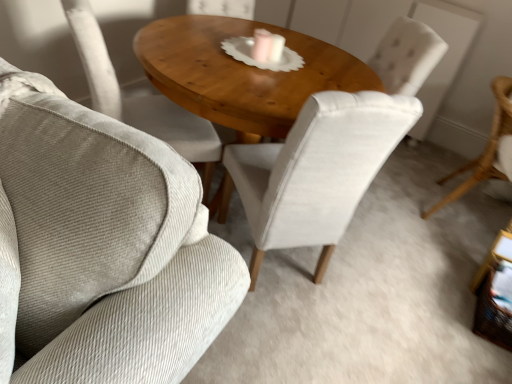
This screenshot has height=384, width=512. I want to click on light brown wicker chair at right, positioned as the 3th chair in left-to-right order, so click(x=486, y=148).

Locate an element on the screen. light beige fabric chair at center, which ranks as the third chair in right-to-left order is located at coordinates (140, 98).

What is the approximate width of light beige fabric chair at center, which ranks as the third chair in right-to-left order?

light beige fabric chair at center, which ranks as the third chair in right-to-left order, is 24.38 inches in width.

The image size is (512, 384). Find the location of `woven wicker side table at lower right`. woven wicker side table at lower right is located at coordinates (495, 293).

Locate an element on the screen. The height and width of the screenshot is (384, 512). wooden polished table at center is located at coordinates (242, 73).

Is velvet white chair at center, which ranks as the 2th chair in right-to-left order, positioned with its back to light brown wicker chair at right, acting as the 1th chair starting from the right?

No, velvet white chair at center, which ranks as the 2th chair in right-to-left order,'s orientation is not away from light brown wicker chair at right, acting as the 1th chair starting from the right.

In the image, is velvet white chair at center, placed as the 2th chair when sorted from left to right, on the left side or the right side of light brown wicker chair at right, acting as the 1th chair starting from the right?

In the image, velvet white chair at center, placed as the 2th chair when sorted from left to right, appears on the left side of light brown wicker chair at right, acting as the 1th chair starting from the right.

Is point (258, 178) closer to viewer compared to point (507, 81)?

That is True.

From the picture: How much distance is there between light beige fabric chair at center, which ranks as the third chair in right-to-left order, and velvet white chair at center, which ranks as the 2th chair in right-to-left order?

The distance of light beige fabric chair at center, which ranks as the third chair in right-to-left order, from velvet white chair at center, which ranks as the 2th chair in right-to-left order, is 21.51 inches.

This screenshot has width=512, height=384. In order to click on chair in front of the light beige fabric chair at center, which ranks as the third chair in right-to-left order in this screenshot , I will do `click(317, 170)`.

Does light beige fabric chair at center, which is counted as the first chair, starting from the left, have a lesser height compared to velvet white chair at center, placed as the 2th chair when sorted from left to right?

Indeed, light beige fabric chair at center, which is counted as the first chair, starting from the left, has a lesser height compared to velvet white chair at center, placed as the 2th chair when sorted from left to right.

Is velvet white chair at center, placed as the 2th chair when sorted from left to right, inside light beige fabric chair at center, which is counted as the first chair, starting from the left?

No.

Which of these two, light beige fabric chair at center, which is counted as the first chair, starting from the left, or woven wicker side table at lower right, is thinner?

Thinner between the two is woven wicker side table at lower right.

Is light beige fabric chair at center, which is counted as the first chair, starting from the left, positioned with its back to woven wicker side table at lower right?

No, light beige fabric chair at center, which is counted as the first chair, starting from the left, is not facing away from woven wicker side table at lower right.

Is light beige fabric chair at center, which is counted as the first chair, starting from the left, at the right side of woven wicker side table at lower right?

No, light beige fabric chair at center, which is counted as the first chair, starting from the left, is not to the right of woven wicker side table at lower right.

This screenshot has width=512, height=384. I want to click on side table below the light beige fabric chair at center, which is counted as the first chair, starting from the left (from the image's perspective), so click(x=495, y=293).

Choose the correct answer: Is light brown wicker chair at right, positioned as the 3th chair in left-to-right order, inside woven wicker side table at lower right or outside it?

light brown wicker chair at right, positioned as the 3th chair in left-to-right order, is spatially situated outside woven wicker side table at lower right.

Who is shorter, light brown wicker chair at right, acting as the 1th chair starting from the right, or woven wicker side table at lower right?

With less height is woven wicker side table at lower right.

Does velvet white chair at center, placed as the 2th chair when sorted from left to right, have a greater height compared to light beige fabric chair at center, which is counted as the first chair, starting from the left?

Correct, velvet white chair at center, placed as the 2th chair when sorted from left to right, is much taller as light beige fabric chair at center, which is counted as the first chair, starting from the left.

Considering the relative sizes of velvet white chair at center, which ranks as the 2th chair in right-to-left order, and light beige fabric chair at center, which is counted as the first chair, starting from the left, in the image provided, is velvet white chair at center, which ranks as the 2th chair in right-to-left order, smaller than light beige fabric chair at center, which is counted as the first chair, starting from the left,?

Incorrect, velvet white chair at center, which ranks as the 2th chair in right-to-left order, is not smaller in size than light beige fabric chair at center, which is counted as the first chair, starting from the left.

Looking at this image, are velvet white chair at center, which ranks as the 2th chair in right-to-left order, and light beige fabric chair at center, which is counted as the first chair, starting from the left, making contact?

They are not placed beside each other.

Considering the points (318, 273) and (194, 149), which point is in front, point (318, 273) or point (194, 149)?

The point (194, 149) is closer to the camera.

From a real-world perspective, is woven wicker side table at lower right above or below light brown wicker chair at right, positioned as the 3th chair in left-to-right order?

In terms of real-world spatial position, woven wicker side table at lower right is below light brown wicker chair at right, positioned as the 3th chair in left-to-right order.

In the scene shown: Is woven wicker side table at lower right at the right side of light brown wicker chair at right, acting as the 1th chair starting from the right?

No.

Looking at this image, is there a large distance between woven wicker side table at lower right and light brown wicker chair at right, positioned as the 3th chair in left-to-right order?

No, woven wicker side table at lower right is in close proximity to light brown wicker chair at right, positioned as the 3th chair in left-to-right order.

From a real-world perspective, between wooden polished table at center and light beige fabric chair at center, which ranks as the third chair in right-to-left order, who is vertically higher?

light beige fabric chair at center, which ranks as the third chair in right-to-left order, from a real-world perspective.

Which of these two, wooden polished table at center or light beige fabric chair at center, which is counted as the first chair, starting from the left, stands taller?

wooden polished table at center.

In the image, is wooden polished table at center positioned in front of or behind light beige fabric chair at center, which is counted as the first chair, starting from the left?

In the image, wooden polished table at center appears in front of light beige fabric chair at center, which is counted as the first chair, starting from the left.

Does wooden polished table at center have a lesser width compared to light beige fabric chair at center, which ranks as the third chair in right-to-left order?

Incorrect, the width of wooden polished table at center is not less than that of light beige fabric chair at center, which ranks as the third chair in right-to-left order.

From the image's perspective, which chair is the 1st one above the velvet white chair at center, placed as the 2th chair when sorted from left to right? Please provide its 2D coordinates.

[(486, 148)]

From a real-world perspective, starting from the light beige fabric chair at center, which is counted as the first chair, starting from the left, which chair is the 1st one below it? Please provide its 2D coordinates.

[(317, 170)]

Estimate the real-world distances between objects in this image. Which object is closer to woven wicker side table at lower right, light brown wicker chair at right, positioned as the 3th chair in left-to-right order, or light beige fabric chair at center, which is counted as the first chair, starting from the left?

Based on the image, light brown wicker chair at right, positioned as the 3th chair in left-to-right order, appears to be nearer to woven wicker side table at lower right.

In the scene shown: When comparing their distances from woven wicker side table at lower right, does wooden polished table at center or velvet white chair at center, which ranks as the 2th chair in right-to-left order, seem closer?

velvet white chair at center, which ranks as the 2th chair in right-to-left order, is positioned closer to the anchor woven wicker side table at lower right.

Based on their spatial positions, is light beige fabric chair at center, which ranks as the third chair in right-to-left order, or wooden polished table at center further from velvet white chair at center, which ranks as the 2th chair in right-to-left order?

light beige fabric chair at center, which ranks as the third chair in right-to-left order, lies further to velvet white chair at center, which ranks as the 2th chair in right-to-left order, than the other object.

Based on their spatial positions, is light brown wicker chair at right, acting as the 1th chair starting from the right, or woven wicker side table at lower right further from wooden polished table at center?

The object further to wooden polished table at center is woven wicker side table at lower right.

Based on their spatial positions, is light beige fabric chair at center, which is counted as the first chair, starting from the left, or wooden polished table at center closer to light brown wicker chair at right, acting as the 1th chair starting from the right?

Among the two, wooden polished table at center is located nearer to light brown wicker chair at right, acting as the 1th chair starting from the right.

When comparing their distances from woven wicker side table at lower right, does light beige fabric chair at center, which is counted as the first chair, starting from the left, or wooden polished table at center seem closer?

wooden polished table at center.

From the image, which object appears to be farther from velvet white chair at center, placed as the 2th chair when sorted from left to right, light beige fabric chair at center, which is counted as the first chair, starting from the left, or woven wicker side table at lower right?

woven wicker side table at lower right lies further to velvet white chair at center, placed as the 2th chair when sorted from left to right, than the other object.

When comparing their distances from velvet white chair at center, which ranks as the 2th chair in right-to-left order, does light brown wicker chair at right, positioned as the 3th chair in left-to-right order, or woven wicker side table at lower right seem closer?

woven wicker side table at lower right is positioned closer to the anchor velvet white chair at center, which ranks as the 2th chair in right-to-left order.

What are the coordinates of `chair between light beige fabric chair at center, which is counted as the first chair, starting from the left, and woven wicker side table at lower right from left to right` in the screenshot? It's located at (317, 170).

At what (x,y) coordinates should I click in order to perform the action: click on chair situated between wooden polished table at center and woven wicker side table at lower right from left to right. Please return your answer as a coordinate pair (x, y). Looking at the image, I should click on (317, 170).

Where is `chair between wooden polished table at center and light brown wicker chair at right, positioned as the 3th chair in left-to-right order, from left to right`? The image size is (512, 384). chair between wooden polished table at center and light brown wicker chair at right, positioned as the 3th chair in left-to-right order, from left to right is located at coordinates tap(317, 170).

Image resolution: width=512 pixels, height=384 pixels. Identify the location of coffee table located between light beige fabric chair at center, which ranks as the third chair in right-to-left order, and velvet white chair at center, which ranks as the 2th chair in right-to-left order, in the left-right direction. (242, 73).